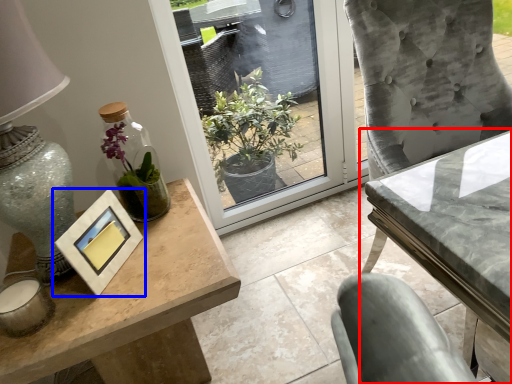
Question: Which object is further to the camera taking this photo, table (highlighted by a red box) or picture frame (highlighted by a blue box)?

Choices:
 (A) table
 (B) picture frame

Answer: (B)